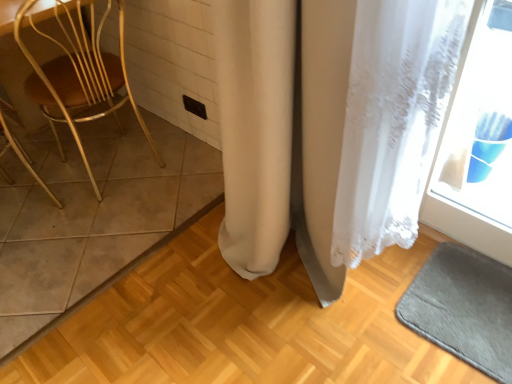
Question: Considering the relative sizes of wooden chair at left and gray soft bath mat at lower right in the image provided, is wooden chair at left bigger than gray soft bath mat at lower right?

Choices:
 (A) no
 (B) yes

Answer: (B)

Question: Is the position of wooden chair at left more distant than that of gray soft bath mat at lower right?

Choices:
 (A) no
 (B) yes

Answer: (B)

Question: Considering the relative sizes of wooden chair at left and gray soft bath mat at lower right in the image provided, is wooden chair at left smaller than gray soft bath mat at lower right?

Choices:
 (A) yes
 (B) no

Answer: (B)

Question: From the image's perspective, would you say wooden chair at left is shown under gray soft bath mat at lower right?

Choices:
 (A) yes
 (B) no

Answer: (B)

Question: Would you say wooden chair at left is a long distance from gray soft bath mat at lower right?

Choices:
 (A) yes
 (B) no

Answer: (A)

Question: Is wooden chair at left oriented away from gray soft bath mat at lower right?

Choices:
 (A) yes
 (B) no

Answer: (A)

Question: From a real-world perspective, is white lace curtain at center under gray soft bath mat at lower right?

Choices:
 (A) yes
 (B) no

Answer: (B)

Question: Is white lace curtain at center bigger than gray soft bath mat at lower right?

Choices:
 (A) yes
 (B) no

Answer: (A)

Question: Can you confirm if white lace curtain at center is shorter than gray soft bath mat at lower right?

Choices:
 (A) no
 (B) yes

Answer: (A)

Question: Is white lace curtain at center turned away from gray soft bath mat at lower right?

Choices:
 (A) yes
 (B) no

Answer: (B)

Question: Is white lace curtain at center aimed at gray soft bath mat at lower right?

Choices:
 (A) yes
 (B) no

Answer: (B)

Question: Can you confirm if white lace curtain at center is taller than gray soft bath mat at lower right?

Choices:
 (A) no
 (B) yes

Answer: (B)

Question: Considering the relative sizes of white lace curtain at center and brown tile at left in the image provided, is white lace curtain at center thinner than brown tile at left?

Choices:
 (A) no
 (B) yes

Answer: (B)